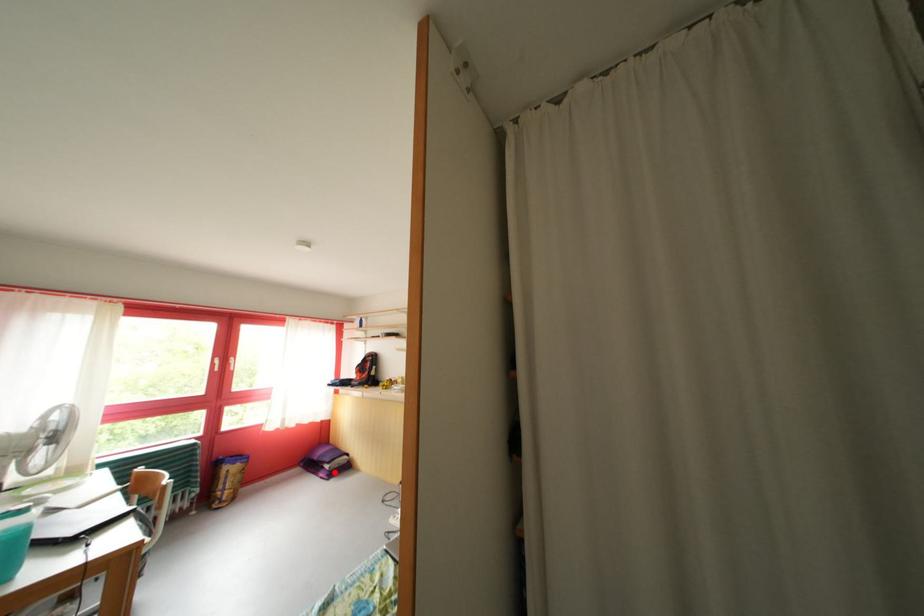
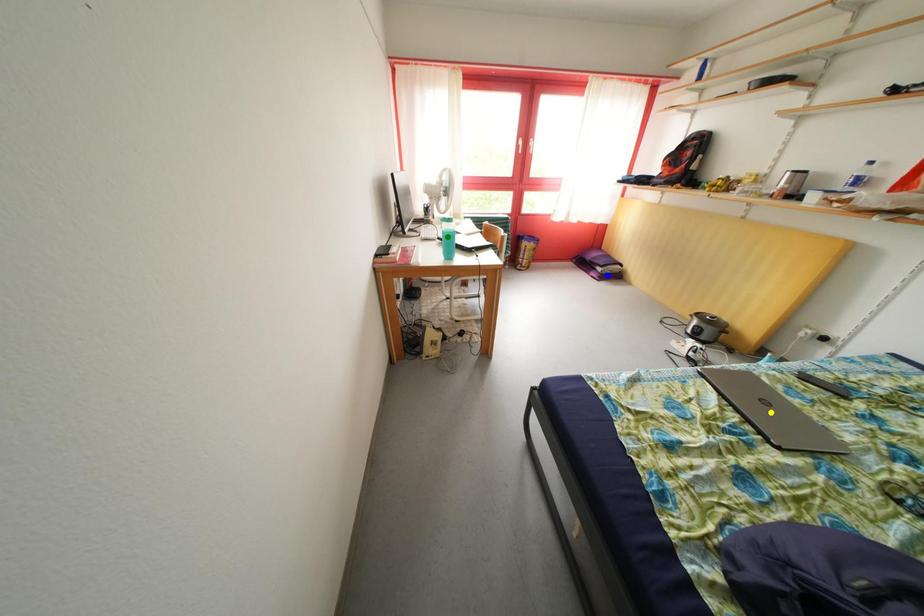
Question: I am providing you with two images of the same scene from different viewpoints. A red point is marked on the first image. You are given multiple points on the second image. In image 2, which mark is for the same physical point as the one in image 1?

Choices:
 (A) blue point
 (B) yellow point
 (C) green point

Answer: (A)